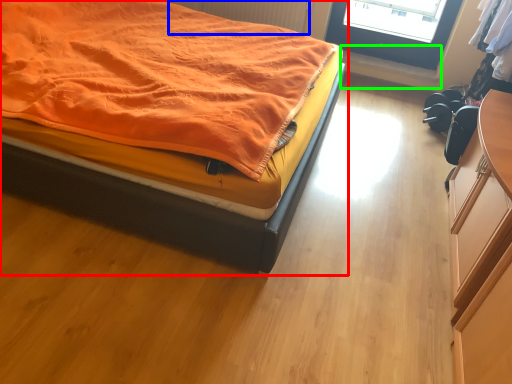
Question: Which object is positioned closest to bed (highlighted by a red box)? Select from radiator (highlighted by a blue box) and window sill (highlighted by a green box).

Choices:
 (A) radiator
 (B) window sill

Answer: (A)